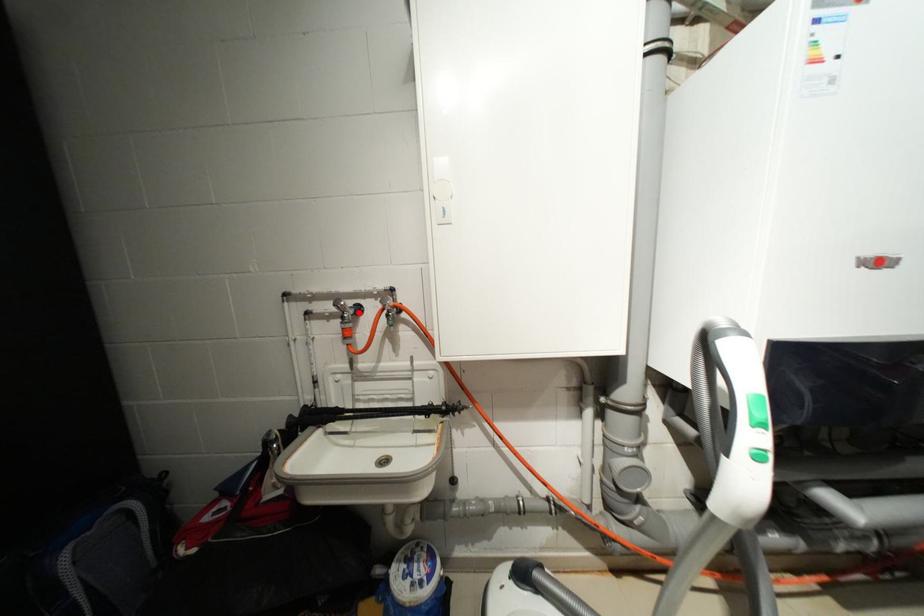
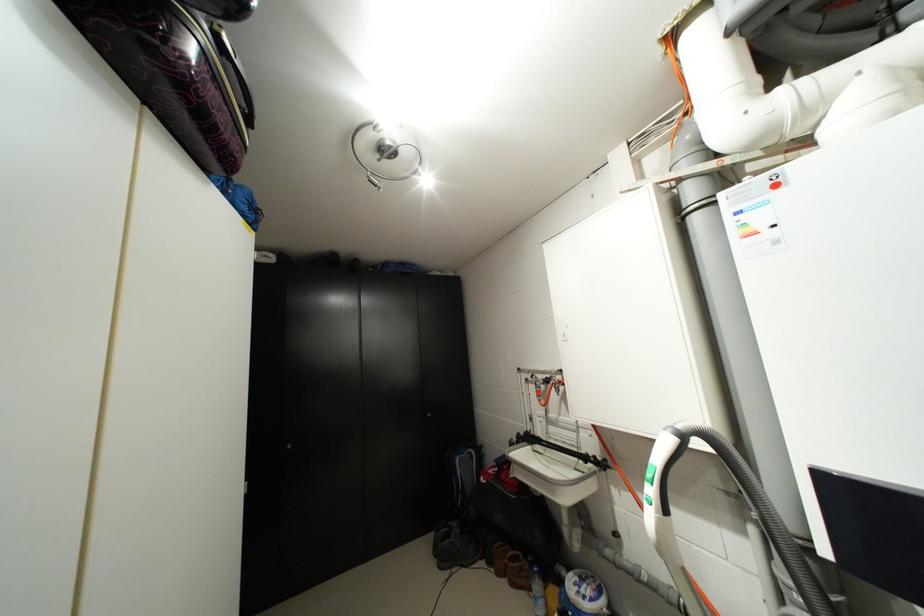
Where in the second image is the point corresponding to the highlighted location from the first image?

(549, 383)